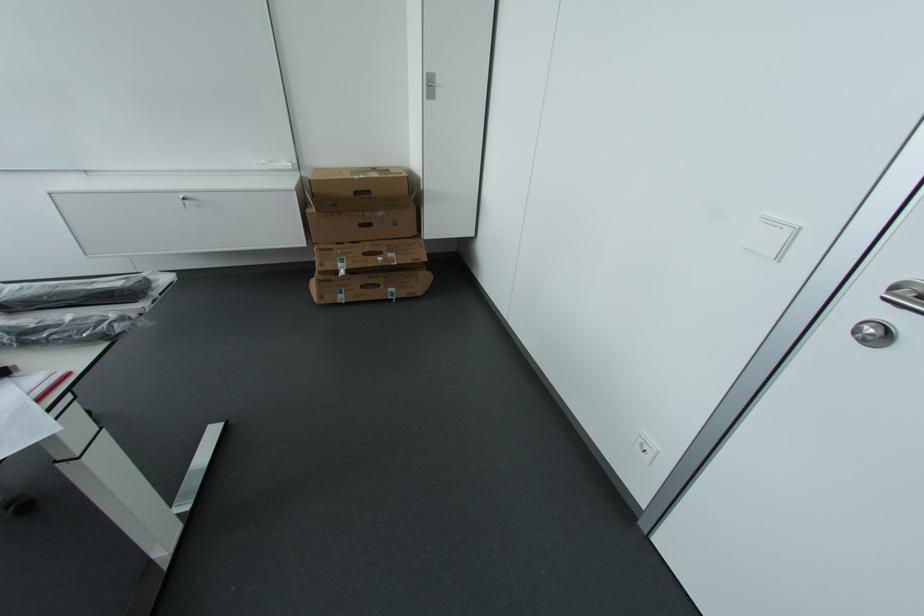
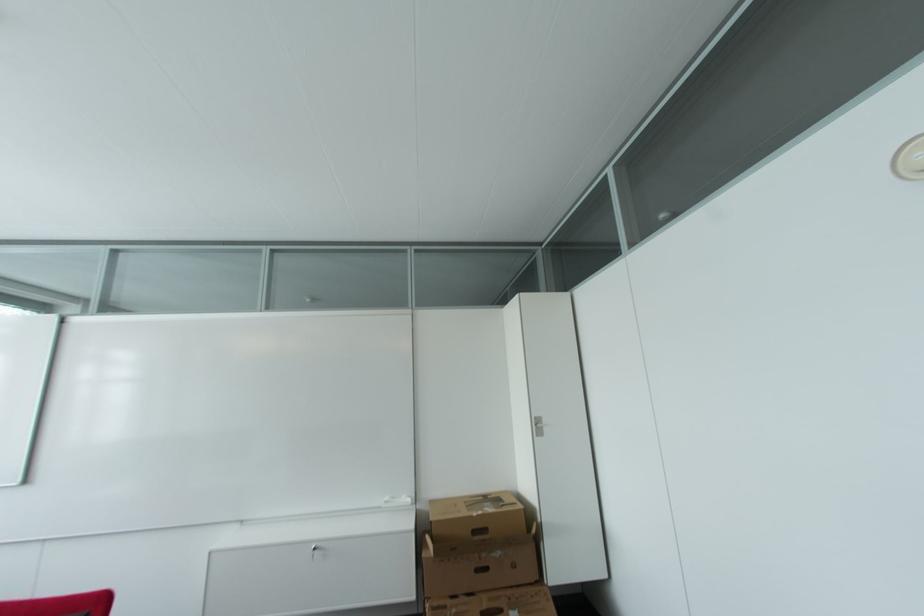
In the second image, find the point that corresponds to pixel 431 86 in the first image.

(540, 426)